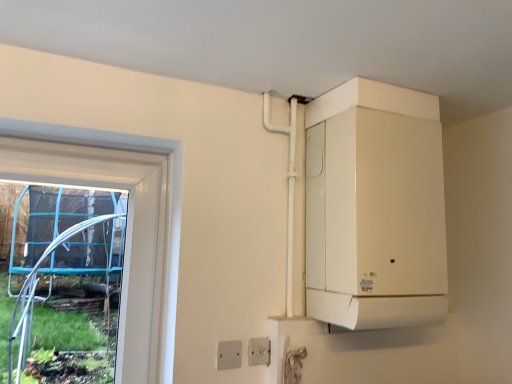
Question: From the image's perspective, is white plastic electric outlet at lower center, which ranks as the second electric outlet in left-to-right order, located above or below white plastic electric outlet at lower center, the first electric outlet when ordered from front to back?

Choices:
 (A) above
 (B) below

Answer: (B)

Question: Is white plastic electric outlet at lower center, marked as the 1th electric outlet in a back-to-front arrangement, taller or shorter than white plastic electric outlet at lower center, which is the first electric outlet in left-to-right order?

Choices:
 (A) short
 (B) tall

Answer: (A)

Question: Which of these objects is positioned farthest from the white matte boiler at upper right?

Choices:
 (A) white plastic electric outlet at lower center, which is counted as the second electric outlet, starting from the right
 (B) white plastic electric outlet at lower center, which ranks as the second electric outlet in left-to-right order

Answer: (A)

Question: Which object is the farthest from the white plastic electric outlet at lower center, which is the first electric outlet in left-to-right order?

Choices:
 (A) white matte boiler at upper right
 (B) white plastic electric outlet at lower center, marked as the 1th electric outlet in a back-to-front arrangement

Answer: (A)